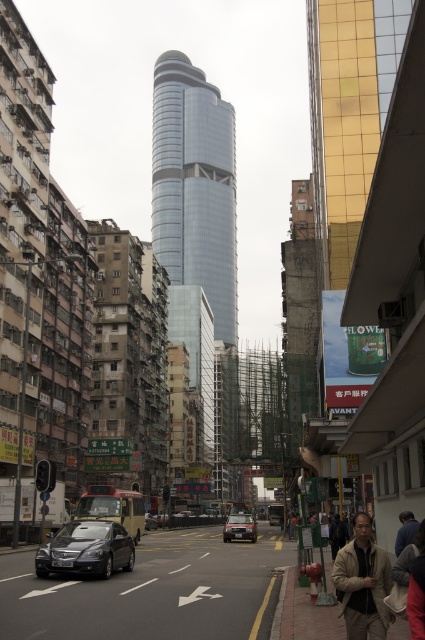
You are standing in the middle of the bustling urban street scene. You see a blue fabric shirt at lower right. Where exactly is the blue fabric shirt located in terms of coordinates?

The blue fabric shirt at lower right is located at point (x=405, y=531).

You are a delivery person trying to park your vehicle between the shiny black sedan at lower left and the black rubber car at center. Given that your delivery van is 5 meters long, can you fit it in the space between them?

The shiny black sedan at lower left is smaller than the black rubber car at center, but the description does not provide the exact distance between them. Without knowing the space between the two cars, it is impossible to determine if the 5 meter long van can fit there.